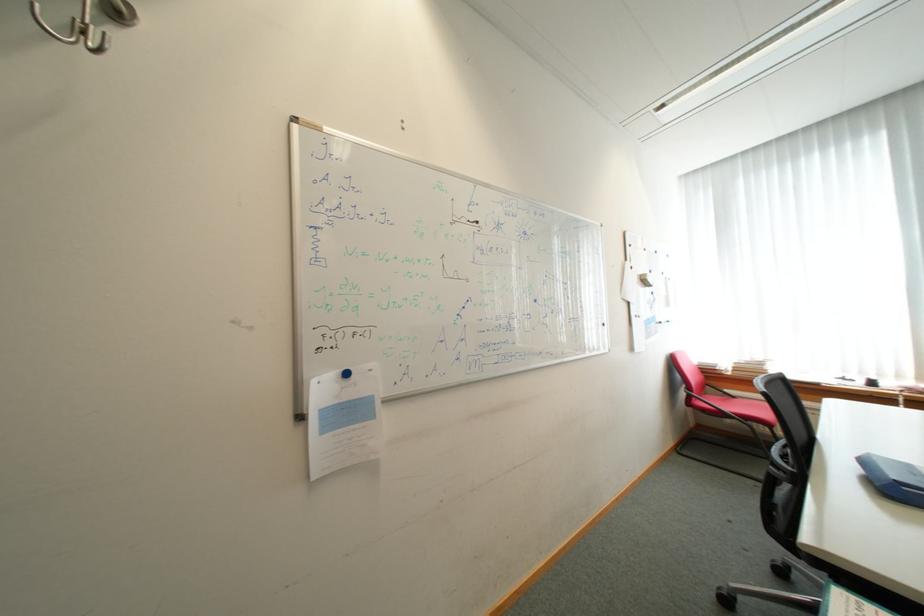
I want to click on black chair armrest, so click(787, 463).